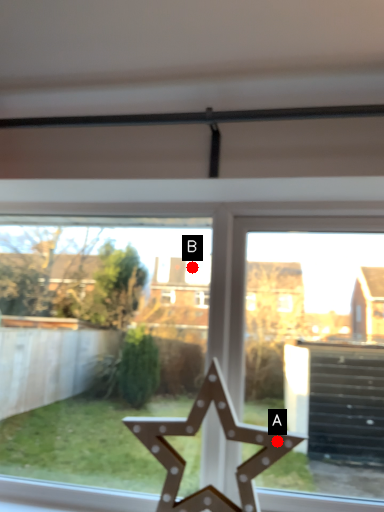
Question: Two points are circled on the image, labeled by A and B beside each circle. Which of the following is the closest to the observer?

Choices:
 (A) A is closer
 (B) B is closer

Answer: (A)